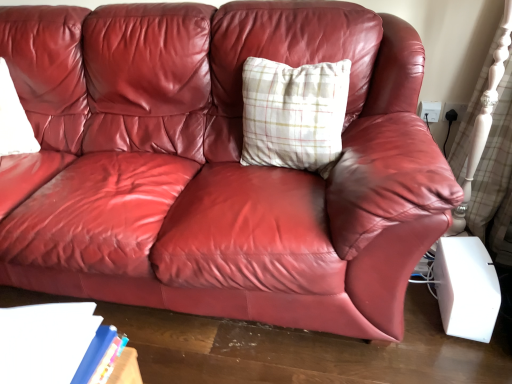
Identify the location of blue hardcover book at lower left. (62, 347).

The height and width of the screenshot is (384, 512). What do you see at coordinates (62, 347) in the screenshot?
I see `blue hardcover book at lower left` at bounding box center [62, 347].

What are the coordinates of `white plaid pillow at center` in the screenshot? It's located at (294, 114).

Describe the element at coordinates (294, 114) in the screenshot. I see `white plaid pillow at center` at that location.

At what (x,y) coordinates should I click in order to perform the action: click on blue hardcover book at lower left. Please return your answer as a coordinate pair (x, y). Looking at the image, I should click on (62, 347).

Considering the relative positions of white plaid pillow at center and blue hardcover book at lower left in the image provided, is white plaid pillow at center to the left or to the right of blue hardcover book at lower left?

white plaid pillow at center is positioned on blue hardcover book at lower left's right side.

Which object is closer to the camera, white plaid pillow at center or blue hardcover book at lower left?

blue hardcover book at lower left is in front.

Which point is more forward, (307, 77) or (117, 378)?

The point (117, 378) is closer.

From the image's perspective, is white plaid pillow at center beneath blue hardcover book at lower left?

No, from the image's perspective, white plaid pillow at center is not beneath blue hardcover book at lower left.

From a real-world perspective, is white plaid pillow at center beneath blue hardcover book at lower left?

Actually, white plaid pillow at center is physically above blue hardcover book at lower left in the real world.

Considering the sizes of objects white plaid pillow at center and blue hardcover book at lower left in the image provided, who is thinner, white plaid pillow at center or blue hardcover book at lower left?

Thinner between the two is blue hardcover book at lower left.

Considering the sizes of objects white plaid pillow at center and blue hardcover book at lower left in the image provided, who is taller, white plaid pillow at center or blue hardcover book at lower left?

Standing taller between the two is white plaid pillow at center.

Does white plaid pillow at center have a larger size compared to blue hardcover book at lower left?

Yes.

Could blue hardcover book at lower left be considered to be inside white plaid pillow at center?

No, white plaid pillow at center does not contain blue hardcover book at lower left.

Is there a large distance between white plaid pillow at center and blue hardcover book at lower left?

No.

Is white plaid pillow at center positioned with its back to blue hardcover book at lower left?

No, white plaid pillow at center is not facing away from blue hardcover book at lower left.

What's the angular difference between white plaid pillow at center and blue hardcover book at lower left's facing directions?

The facing directions of white plaid pillow at center and blue hardcover book at lower left are 163 degrees apart.

Measure the distance between white plaid pillow at center and blue hardcover book at lower left.

white plaid pillow at center is 90.78 centimeters from blue hardcover book at lower left.

In order to click on book below the white plaid pillow at center (from the image's perspective) in this screenshot , I will do `click(62, 347)`.

Can you confirm if blue hardcover book at lower left is positioned to the left of white plaid pillow at center?

Yes.

Is the position of blue hardcover book at lower left more distant than that of white plaid pillow at center?

No, blue hardcover book at lower left is closer to the viewer.

Does point (86, 319) come in front of point (308, 147)?

Yes.

From the image's perspective, is blue hardcover book at lower left below white plaid pillow at center?

Yes.

Consider the image. From a real-world perspective, is blue hardcover book at lower left positioned under white plaid pillow at center based on gravity?

Correct, in the physical world, blue hardcover book at lower left is lower than white plaid pillow at center.

Considering the relative sizes of blue hardcover book at lower left and white plaid pillow at center in the image provided, is blue hardcover book at lower left thinner than white plaid pillow at center?

Yes.

Considering the sizes of objects blue hardcover book at lower left and white plaid pillow at center in the image provided, who is taller, blue hardcover book at lower left or white plaid pillow at center?

white plaid pillow at center.

Considering the sizes of objects blue hardcover book at lower left and white plaid pillow at center in the image provided, who is smaller, blue hardcover book at lower left or white plaid pillow at center?

With smaller size is blue hardcover book at lower left.

Can we say blue hardcover book at lower left lies outside white plaid pillow at center?

Indeed, blue hardcover book at lower left is completely outside white plaid pillow at center.

Is blue hardcover book at lower left in contact with white plaid pillow at center?

blue hardcover book at lower left and white plaid pillow at center are clearly separated.

Based on the photo, is blue hardcover book at lower left oriented away from white plaid pillow at center?

No.

What's the angular difference between blue hardcover book at lower left and white plaid pillow at center's facing directions?

The angle between the facing direction of blue hardcover book at lower left and the facing direction of white plaid pillow at center is 163 degrees.

The height and width of the screenshot is (384, 512). I want to click on book in front of the white plaid pillow at center, so tap(62, 347).

At what (x,y) coordinates should I click in order to perform the action: click on book in front of the white plaid pillow at center. Please return your answer as a coordinate pair (x, y). The height and width of the screenshot is (384, 512). Looking at the image, I should click on (62, 347).

The width and height of the screenshot is (512, 384). Find the location of `pillow above the blue hardcover book at lower left (from the image's perspective)`. pillow above the blue hardcover book at lower left (from the image's perspective) is located at coordinates (294, 114).